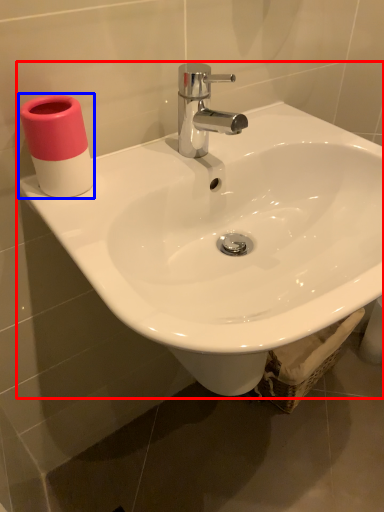
Question: Which of the following is the farthest to the observer, sink (highlighted by a red box) or toiletry (highlighted by a blue box)?

Choices:
 (A) sink
 (B) toiletry

Answer: (B)